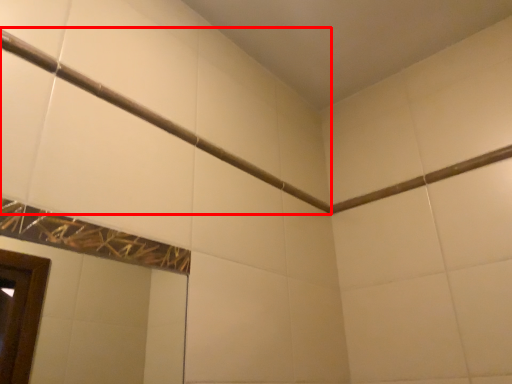
Question: Considering the relative positions of shower (annotated by the red box) and beam in the image provided, where is shower (annotated by the red box) located with respect to the staircase?

Choices:
 (A) left
 (B) right

Answer: (A)